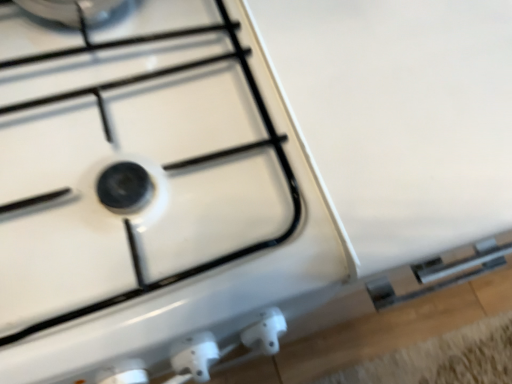
Identify the location of white glossy gas stove at center. The image size is (512, 384). (148, 190).

The image size is (512, 384). Describe the element at coordinates (148, 190) in the screenshot. I see `white glossy gas stove at center` at that location.

Identify the location of white glossy gas stove at center. The width and height of the screenshot is (512, 384). (148, 190).